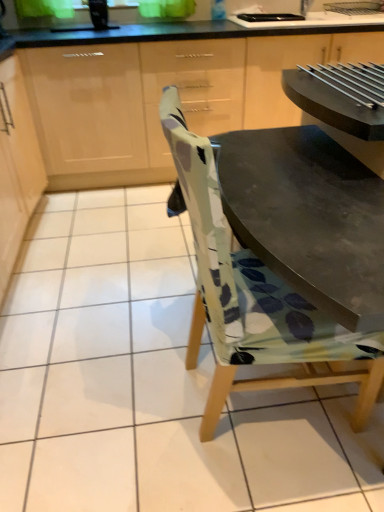
How much space does matte wood cabinets at upper center, placed as the 2th cabinetry when sorted from left to right, occupy horizontally?

matte wood cabinets at upper center, placed as the 2th cabinetry when sorted from left to right, is 69.56 centimeters in width.

Identify the location of matte wood cabinets at upper center, placed as the 2th cabinetry when sorted from left to right. (133, 112).

Image resolution: width=384 pixels, height=512 pixels. What do you see at coordinates (256, 301) in the screenshot? I see `printed fabric chair at center` at bounding box center [256, 301].

At what (x,y) coordinates should I click in order to perform the action: click on matte wood cabinets at upper center, placed as the 2th cabinetry when sorted from left to right. Please return your answer as a coordinate pair (x, y). Looking at the image, I should click on (133, 112).

Which of these two, light wood cabinet at upper left, the 1th cabinetry positioned from the left, or matte wood cabinets at upper center, the first cabinetry positioned from the right, is thinner?

light wood cabinet at upper left, the 1th cabinetry positioned from the left, is thinner.

Are light wood cabinet at upper left, the 1th cabinetry positioned from the left, and matte wood cabinets at upper center, the first cabinetry positioned from the right, located far from each other?

No, there isn't a large distance between light wood cabinet at upper left, the 1th cabinetry positioned from the left, and matte wood cabinets at upper center, the first cabinetry positioned from the right.

Consider the image. From the image's perspective, which object appears higher, light wood cabinet at upper left, the 1th cabinetry positioned from the left, or matte wood cabinets at upper center, placed as the 2th cabinetry when sorted from left to right?

From the image's view, matte wood cabinets at upper center, placed as the 2th cabinetry when sorted from left to right, is above.

Would you say light wood cabinet at upper left, arranged as the 2th cabinetry when viewed from the right, contains matte wood cabinets at upper center, the first cabinetry positioned from the right?

No, light wood cabinet at upper left, arranged as the 2th cabinetry when viewed from the right, does not contain matte wood cabinets at upper center, the first cabinetry positioned from the right.

Based on the photo, is there a large distance between printed fabric chair at center and light wood cabinet at upper left, arranged as the 2th cabinetry when viewed from the right?

Indeed, printed fabric chair at center is not near light wood cabinet at upper left, arranged as the 2th cabinetry when viewed from the right.

From the picture: Considering the relative sizes of printed fabric chair at center and light wood cabinet at upper left, arranged as the 2th cabinetry when viewed from the right, in the image provided, is printed fabric chair at center smaller than light wood cabinet at upper left, arranged as the 2th cabinetry when viewed from the right,?

Yes.

From a real-world perspective, between printed fabric chair at center and light wood cabinet at upper left, arranged as the 2th cabinetry when viewed from the right, who is vertically lower?

light wood cabinet at upper left, arranged as the 2th cabinetry when viewed from the right, is physically lower.

Can you tell me how much printed fabric chair at center and matte wood cabinets at upper center, the first cabinetry positioned from the right, differ in facing direction?

The angular difference between printed fabric chair at center and matte wood cabinets at upper center, the first cabinetry positioned from the right, is 88.1 degrees.

Is printed fabric chair at center oriented towards matte wood cabinets at upper center, placed as the 2th cabinetry when sorted from left to right?

No, printed fabric chair at center is not oriented towards matte wood cabinets at upper center, placed as the 2th cabinetry when sorted from left to right.

Considering the relative sizes of printed fabric chair at center and matte wood cabinets at upper center, placed as the 2th cabinetry when sorted from left to right, in the image provided, is printed fabric chair at center taller than matte wood cabinets at upper center, placed as the 2th cabinetry when sorted from left to right,?

Correct, printed fabric chair at center is much taller as matte wood cabinets at upper center, placed as the 2th cabinetry when sorted from left to right.

In terms of width, does printed fabric chair at center look wider or thinner when compared to matte wood cabinets at upper center, placed as the 2th cabinetry when sorted from left to right?

In the image, printed fabric chair at center appears to be more narrow than matte wood cabinets at upper center, placed as the 2th cabinetry when sorted from left to right.

Which object is positioned more to the right, matte wood cabinets at upper center, the first cabinetry positioned from the right, or printed fabric chair at center?

Positioned to the right is matte wood cabinets at upper center, the first cabinetry positioned from the right.

From a real-world perspective, which object rests below the other?

In real-world perspective, matte wood cabinets at upper center, placed as the 2th cabinetry when sorted from left to right, is lower.

In the scene shown: Is matte wood cabinets at upper center, placed as the 2th cabinetry when sorted from left to right, next to printed fabric chair at center and touching it?

No, matte wood cabinets at upper center, placed as the 2th cabinetry when sorted from left to right, is not making contact with printed fabric chair at center.

Which is behind, matte wood cabinets at upper center, the first cabinetry positioned from the right, or printed fabric chair at center?

matte wood cabinets at upper center, the first cabinetry positioned from the right, is behind.

How different are the orientations of matte wood cabinets at upper center, placed as the 2th cabinetry when sorted from left to right, and light wood cabinet at upper left, arranged as the 2th cabinetry when viewed from the right, in degrees?

The angle between the facing direction of matte wood cabinets at upper center, placed as the 2th cabinetry when sorted from left to right, and the facing direction of light wood cabinet at upper left, arranged as the 2th cabinetry when viewed from the right, is 90.7 degrees.

In the scene shown: How distant is matte wood cabinets at upper center, placed as the 2th cabinetry when sorted from left to right, from light wood cabinet at upper left, arranged as the 2th cabinetry when viewed from the right?

matte wood cabinets at upper center, placed as the 2th cabinetry when sorted from left to right, is 35.40 centimeters away from light wood cabinet at upper left, arranged as the 2th cabinetry when viewed from the right.

Is matte wood cabinets at upper center, the first cabinetry positioned from the right, far away from light wood cabinet at upper left, arranged as the 2th cabinetry when viewed from the right?

No, there isn't a large distance between matte wood cabinets at upper center, the first cabinetry positioned from the right, and light wood cabinet at upper left, arranged as the 2th cabinetry when viewed from the right.

Could you tell me if matte wood cabinets at upper center, placed as the 2th cabinetry when sorted from left to right, is turned towards light wood cabinet at upper left, arranged as the 2th cabinetry when viewed from the right?

No.

Which is behind, light wood cabinet at upper left, arranged as the 2th cabinetry when viewed from the right, or printed fabric chair at center?

light wood cabinet at upper left, arranged as the 2th cabinetry when viewed from the right, is more distant.

In the scene shown: Is light wood cabinet at upper left, the 1th cabinetry positioned from the left, wider than printed fabric chair at center?

No, light wood cabinet at upper left, the 1th cabinetry positioned from the left, is not wider than printed fabric chair at center.

Considering the relative sizes of light wood cabinet at upper left, the 1th cabinetry positioned from the left, and printed fabric chair at center in the image provided, is light wood cabinet at upper left, the 1th cabinetry positioned from the left, bigger than printed fabric chair at center?

Correct, light wood cabinet at upper left, the 1th cabinetry positioned from the left, is larger in size than printed fabric chair at center.

Is point (6, 79) behind point (219, 234)?

Yes, it is.

At what (x,y) coordinates should I click in order to perform the action: click on cabinetry that appears below the matte wood cabinets at upper center, placed as the 2th cabinetry when sorted from left to right (from a real-world perspective). Please return your answer as a coordinate pair (x, y). The image size is (384, 512). Looking at the image, I should click on (16, 166).

The image size is (384, 512). What are the coordinates of `chair above the light wood cabinet at upper left, the 1th cabinetry positioned from the left (from a real-world perspective)` in the screenshot? It's located at (256, 301).

In the scene shown: Based on their spatial positions, is printed fabric chair at center or light wood cabinet at upper left, arranged as the 2th cabinetry when viewed from the right, further from matte wood cabinets at upper center, the first cabinetry positioned from the right?

printed fabric chair at center is positioned further to the anchor matte wood cabinets at upper center, the first cabinetry positioned from the right.

Which object lies further to the anchor point matte wood cabinets at upper center, placed as the 2th cabinetry when sorted from left to right, light wood cabinet at upper left, arranged as the 2th cabinetry when viewed from the right, or printed fabric chair at center?

printed fabric chair at center is positioned further to the anchor matte wood cabinets at upper center, placed as the 2th cabinetry when sorted from left to right.

Based on their spatial positions, is matte wood cabinets at upper center, placed as the 2th cabinetry when sorted from left to right, or light wood cabinet at upper left, the 1th cabinetry positioned from the left, closer to printed fabric chair at center?

light wood cabinet at upper left, the 1th cabinetry positioned from the left.

Based on their spatial positions, is printed fabric chair at center or matte wood cabinets at upper center, placed as the 2th cabinetry when sorted from left to right, further from light wood cabinet at upper left, arranged as the 2th cabinetry when viewed from the right?

printed fabric chair at center is further to light wood cabinet at upper left, arranged as the 2th cabinetry when viewed from the right.

Looking at the image, which one is located closer to light wood cabinet at upper left, arranged as the 2th cabinetry when viewed from the right, matte wood cabinets at upper center, the first cabinetry positioned from the right, or printed fabric chair at center?

matte wood cabinets at upper center, the first cabinetry positioned from the right, is positioned closer to the anchor light wood cabinet at upper left, arranged as the 2th cabinetry when viewed from the right.

When comparing their distances from printed fabric chair at center, does light wood cabinet at upper left, arranged as the 2th cabinetry when viewed from the right, or matte wood cabinets at upper center, the first cabinetry positioned from the right, seem further?

matte wood cabinets at upper center, the first cabinetry positioned from the right, lies further to printed fabric chair at center than the other object.

This screenshot has width=384, height=512. Find the location of `chair located between light wood cabinet at upper left, the 1th cabinetry positioned from the left, and matte wood cabinets at upper center, placed as the 2th cabinetry when sorted from left to right, in the left-right direction`. chair located between light wood cabinet at upper left, the 1th cabinetry positioned from the left, and matte wood cabinets at upper center, placed as the 2th cabinetry when sorted from left to right, in the left-right direction is located at coordinates (256, 301).